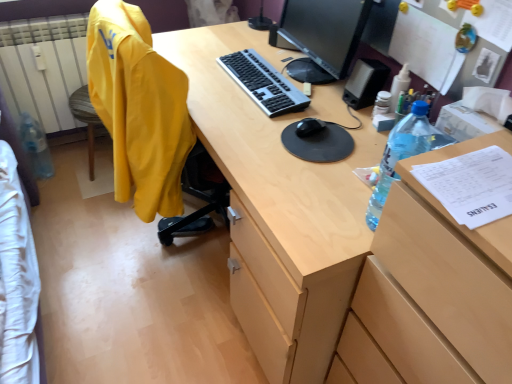
At what (x,y) coordinates should I click in order to perform the action: click on vacant area situated to the left side of black matte mouse at center. Please return your answer as a coordinate pair (x, y). Looking at the image, I should click on (256, 121).